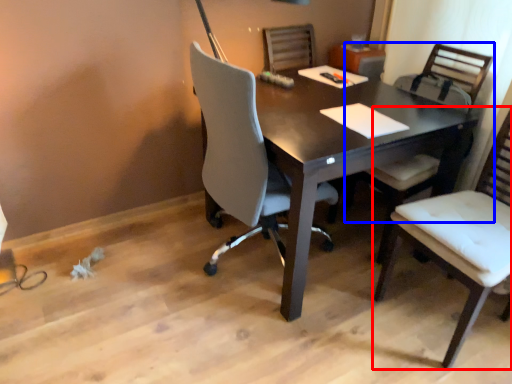
Question: Which point is closer to the camera, chair (highlighted by a red box) or chair (highlighted by a blue box)?

Choices:
 (A) chair
 (B) chair

Answer: (A)